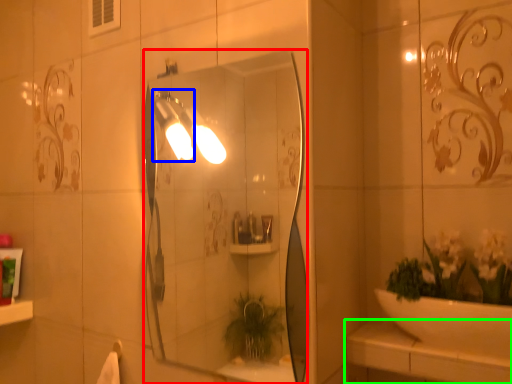
Question: Considering the real-world distances, which object is closest to mirror (highlighted by a red box)? light fixture (highlighted by a blue box) or counter top (highlighted by a green box).

Choices:
 (A) light fixture
 (B) counter top

Answer: (A)